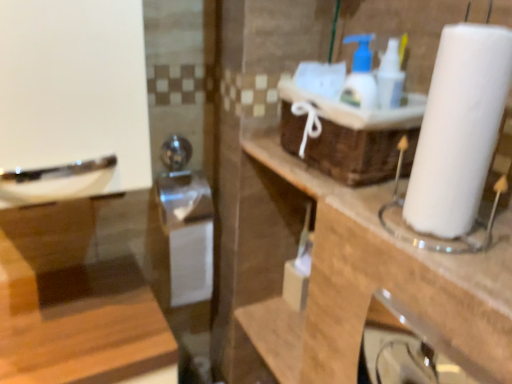
Question: From the image's perspective, does brown woven basket at upper center appear lower than white paper at right?

Choices:
 (A) no
 (B) yes

Answer: (A)

Question: From a real-world perspective, is brown woven basket at upper center positioned over white paper at right based on gravity?

Choices:
 (A) no
 (B) yes

Answer: (A)

Question: From the image's perspective, is brown woven basket at upper center located above white paper at right?

Choices:
 (A) no
 (B) yes

Answer: (B)

Question: Is brown woven basket at upper center positioned beyond the bounds of white paper at right?

Choices:
 (A) yes
 (B) no

Answer: (A)

Question: Is brown woven basket at upper center bigger than white paper at right?

Choices:
 (A) yes
 (B) no

Answer: (A)

Question: Considering their positions, is brown woven basket at upper center located in front of or behind white paper at right?

Choices:
 (A) front
 (B) behind

Answer: (B)

Question: In terms of height, does brown woven basket at upper center look taller or shorter compared to white paper at right?

Choices:
 (A) short
 (B) tall

Answer: (A)

Question: Considering the positions of point (x=330, y=102) and point (x=479, y=99), is point (x=330, y=102) closer or farther from the camera than point (x=479, y=99)?

Choices:
 (A) closer
 (B) farther

Answer: (B)

Question: Considering the positions of brown woven basket at upper center and white paper at right in the image, is brown woven basket at upper center wider or thinner than white paper at right?

Choices:
 (A) thin
 (B) wide

Answer: (B)

Question: Considering the positions of white paper at right and brown woven basket at upper center in the image, is white paper at right wider or thinner than brown woven basket at upper center?

Choices:
 (A) wide
 (B) thin

Answer: (B)

Question: From a real-world perspective, is white paper at right physically located above or below brown woven basket at upper center?

Choices:
 (A) below
 (B) above

Answer: (B)

Question: Looking at the image, does white paper at right seem bigger or smaller compared to brown woven basket at upper center?

Choices:
 (A) small
 (B) big

Answer: (A)

Question: Is white paper at right situated inside brown woven basket at upper center or outside?

Choices:
 (A) outside
 (B) inside

Answer: (A)

Question: From the image's perspective, relative to white paper towel at right, is brown woven basket at upper center above or below?

Choices:
 (A) above
 (B) below

Answer: (A)

Question: From their relative heights in the image, would you say brown woven basket at upper center is taller or shorter than white paper towel at right?

Choices:
 (A) short
 (B) tall

Answer: (B)